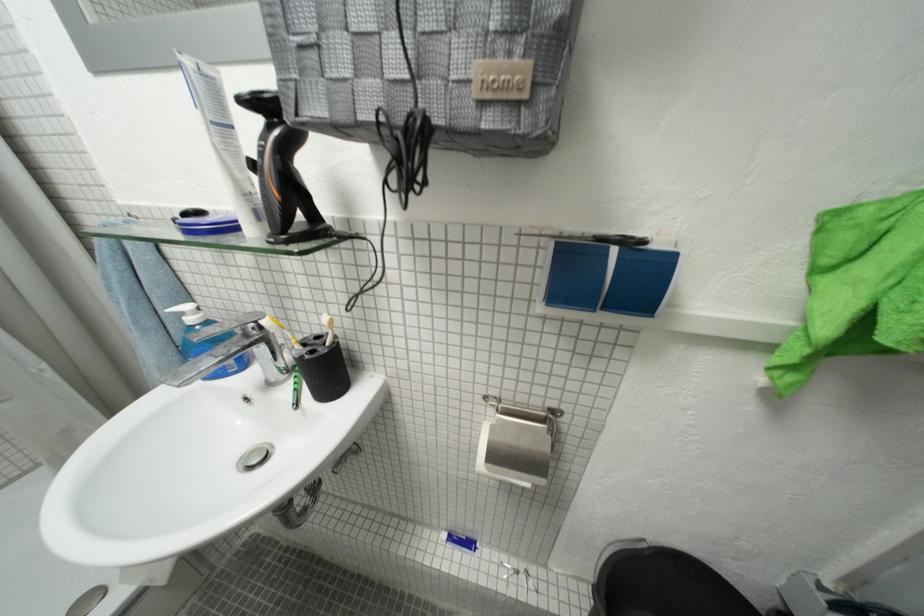
Where would you lift the white toothbrush? Please return your answer as a coordinate pair (x, y).

(327, 328)